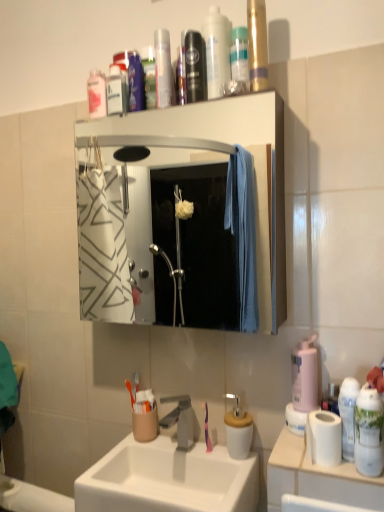
Question: Which is correct: white ceramic sink at center is inside translucent plastic bottle at upper center, which ranks as the first cleaning product in top-to-bottom order, or outside of it?

Choices:
 (A) inside
 (B) outside

Answer: (B)

Question: Looking at their shapes, would you say white ceramic sink at center is wider or thinner than translucent plastic bottle at upper center, the third cleaning product in the front-to-back sequence?

Choices:
 (A) wide
 (B) thin

Answer: (A)

Question: Which of these objects is positioned closest to the satin nickel faucet at sink center?

Choices:
 (A) white ceramic sink at center
 (B) pink matte bottle at right, the second cleaning product positioned from the left
 (C) white matte toilet paper at right
 (D) white glossy spray can at right, which is counted as the 2th toiletry, starting from the back
 (E) shiny metallic can at upper center, the 3th mouthwash viewed from the back

Answer: (A)

Question: Which is nearer to the white glossy bottle at right, arranged as the first cleaning product when ordered from the bottom?

Choices:
 (A) purple glossy toothbrush at sink
 (B) white ceramic sink at center
 (C) white glossy cabinet at upper center
 (D) white glossy spray can at right, which is the first toiletry from right to left
 (E) translucent plastic bottle at upper center, arranged as the first cleaning product when viewed from the back

Answer: (D)